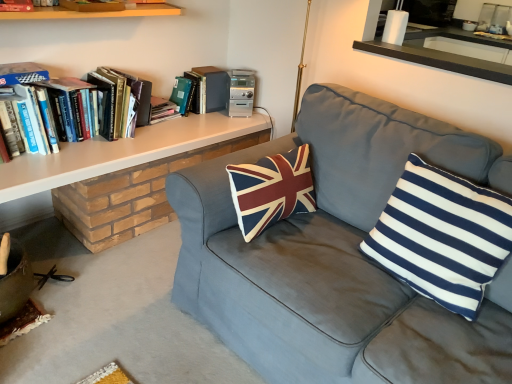
You are a GUI agent. You are given a task and a screenshot of the screen. Output one action in this format:
    pyautogui.click(x=<x>, y=<y>)
    Task: Click on the free space above white matte shelf at upper left (from a real-world perspective)
    
    Given the screenshot: What is the action you would take?
    pyautogui.click(x=134, y=139)